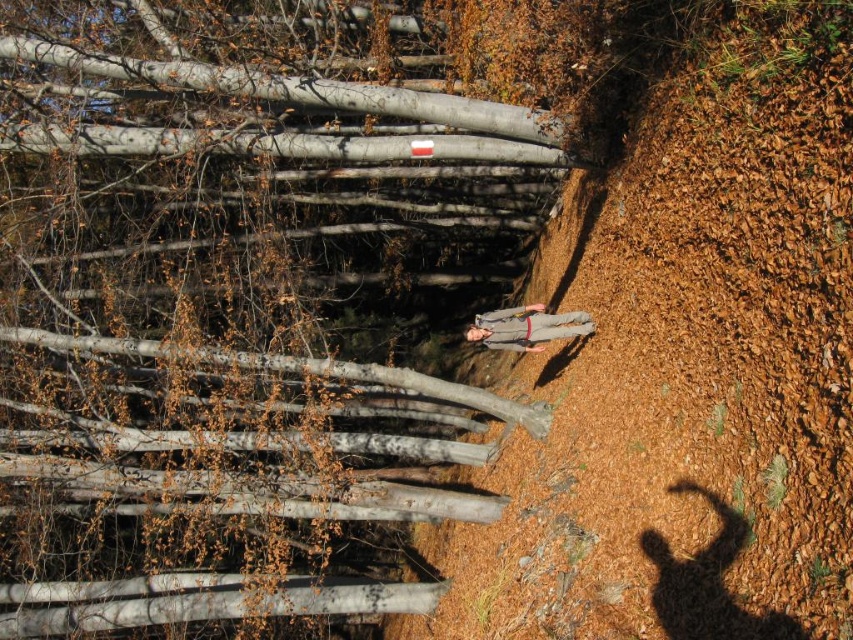
You are a hiker trying to decide whether to walk along the brown dirt track at center or wear the gray fabric jacket at center. Based on their sizes, which one would you choose and why?

The brown dirt track at center is bigger than the gray fabric jacket at center, so you should choose to walk along the brown dirt track at center because it is larger and more suitable for walking compared to the smaller gray fabric jacket at center.

You are planning to take a photo of the smooth bark tree at center and the brown dirt track at center. Which object should you focus on first if you want to capture both in a single frame without moving the camera?

You should focus on the smooth bark tree at center first because it is bigger than the brown dirt track at center, so it will require more attention in the frame.